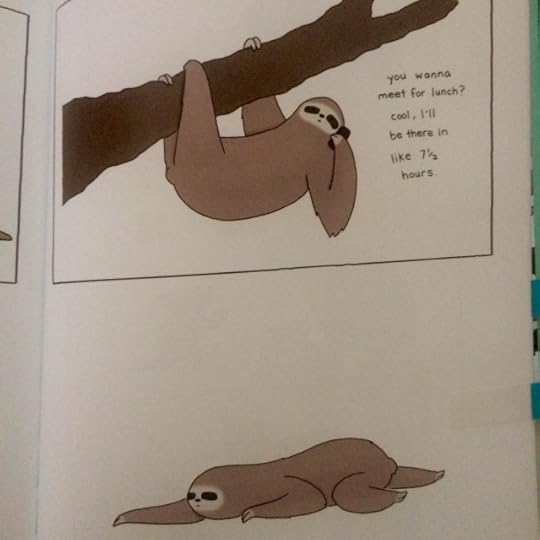
Where is `white wall`? This screenshot has height=540, width=540. white wall is located at coordinates (444, 205).